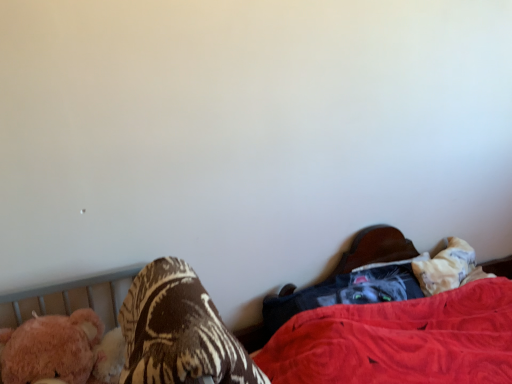
Question: Is fuzzy pink teddy bear at left wider or thinner than dark gray fabric at lower right?

Choices:
 (A) wide
 (B) thin

Answer: (A)

Question: In the image, is fuzzy pink teddy bear at left on the left side or the right side of dark gray fabric at lower right?

Choices:
 (A) right
 (B) left

Answer: (B)

Question: Based on their relative distances, which object is nearer to the velvet black cat at lower right?

Choices:
 (A) dark gray fabric at lower right
 (B) fuzzy pink teddy bear at left
 (C) brown textured blanket at lower left

Answer: (A)

Question: Which object is positioned closest to the dark gray fabric at lower right?

Choices:
 (A) fuzzy pink teddy bear at left
 (B) brown textured blanket at lower left
 (C) velvet black cat at lower right

Answer: (C)